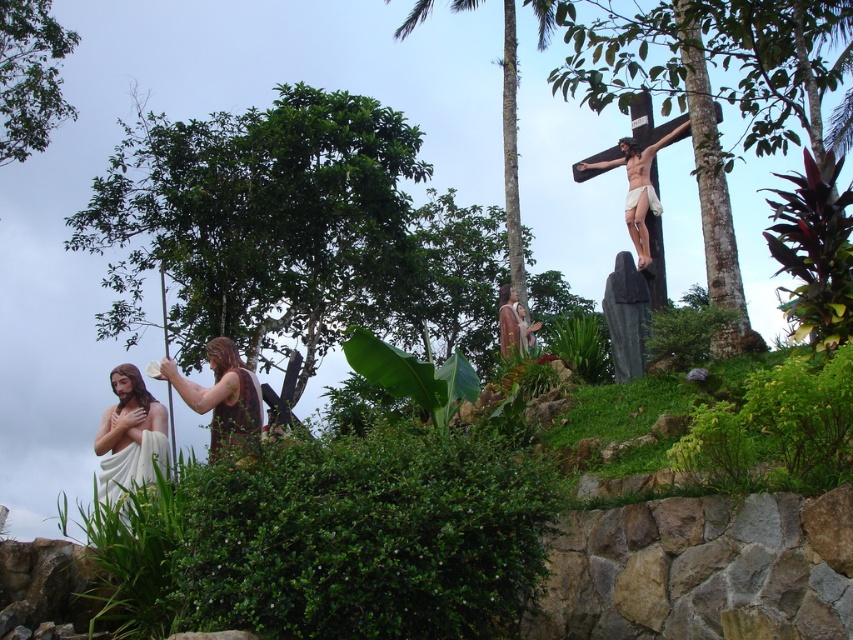
Between point (50, 74) and point (219, 355), which one is positioned behind?

The point (50, 74) is behind.

Based on the photo, measure the distance between point (16,83) and camera.

81.29 meters

Does point (26, 6) come behind point (248, 413)?

Yes, it is behind point (248, 413).

Locate an element on the screen. Image resolution: width=853 pixels, height=640 pixels. green leafy tree at upper left is located at coordinates (30, 76).

Does green leafy tree at left appear on the right side of green leafy tree at center?

No, green leafy tree at left is not to the right of green leafy tree at center.

Between point (276, 186) and point (619, 45), which one is positioned behind?

The point (276, 186) is behind.

This screenshot has width=853, height=640. Find the location of `green leafy tree at left`. green leafy tree at left is located at coordinates (260, 221).

Which of these two, brown textured palm tree at upper right or matte wooden cross at upper right, stands shorter?

With less height is matte wooden cross at upper right.

Does point (515, 182) come in front of point (645, 182)?

No, (515, 182) is further to viewer.

Locate an element on the screen. brown textured palm tree at upper right is located at coordinates (511, 148).